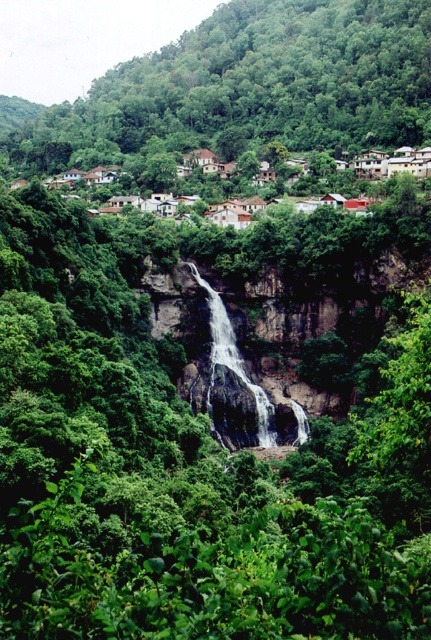
Is point (143, 186) farther from camera compared to point (216, 316)?

Yes, point (143, 186) is farther from viewer.

Is brown wooden houses at upper center positioned before white smooth waterfall at center?

No.

Who is more distant from viewer, (337,204) or (259,387)?

Positioned behind is point (337,204).

Image resolution: width=431 pixels, height=640 pixels. I want to click on brown wooden houses at upper center, so click(x=184, y=179).

Is green leafy tree at upper center closer to camera compared to white smooth waterfall at center?

No, green leafy tree at upper center is behind white smooth waterfall at center.

Does green leafy tree at upper center appear under white smooth waterfall at center?

No, green leafy tree at upper center is not below white smooth waterfall at center.

Locate an element on the screen. The height and width of the screenshot is (640, 431). green leafy tree at upper center is located at coordinates (252, 86).

Where is `green leafy tree at upper center`? The width and height of the screenshot is (431, 640). green leafy tree at upper center is located at coordinates (252, 86).

How much distance is there between green leafy tree at upper center and brown wooden houses at upper center?

green leafy tree at upper center and brown wooden houses at upper center are 58.73 meters apart.

Which is behind, point (287, 22) or point (118, 189)?

The point (287, 22) is behind.

At what (x,y) coordinates should I click in order to perform the action: click on green leafy tree at upper center. Please return your answer as a coordinate pair (x, y). Image resolution: width=431 pixels, height=640 pixels. Looking at the image, I should click on pos(252,86).